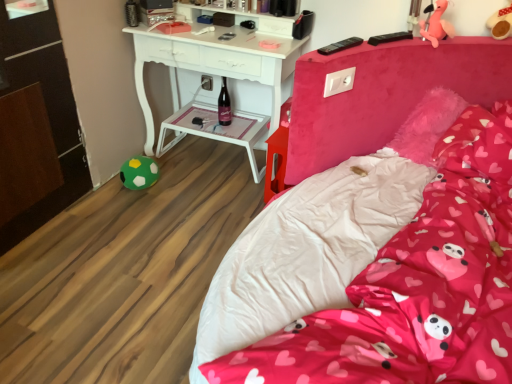
How much space does pink plush toy at upper right, marked as the 3th toy in a bottom-to-top arrangement, occupy vertically?

pink plush toy at upper right, marked as the 3th toy in a bottom-to-top arrangement, is 6.46 inches in height.

I want to click on pink plush toy at upper right, the 3th toy from the left, so click(x=501, y=23).

Where is `pink fabric pillow at center`? pink fabric pillow at center is located at coordinates (479, 143).

Locate an element on the screen. The width and height of the screenshot is (512, 384). pink fabric bed at center is located at coordinates (376, 271).

This screenshot has height=384, width=512. What do you see at coordinates (376, 271) in the screenshot?
I see `pink fabric bed at center` at bounding box center [376, 271].

This screenshot has height=384, width=512. What are the coordinates of `pink plush toy at upper right, the first toy viewed from the front` in the screenshot? It's located at (436, 24).

From the image's perspective, is green felt ball at lower left, the 1th toy when ordered from left to right, over white plastic side table at center?

Incorrect, from the image's perspective, green felt ball at lower left, the 1th toy when ordered from left to right, is lower than white plastic side table at center.

Can you confirm if green felt ball at lower left, acting as the 3th toy starting from the top, is shorter than white plastic side table at center?

Correct, green felt ball at lower left, acting as the 3th toy starting from the top, is not as tall as white plastic side table at center.

Considering the sizes of objects green felt ball at lower left, the 1th toy in the back-to-front sequence, and white plastic side table at center in the image provided, who is thinner, green felt ball at lower left, the 1th toy in the back-to-front sequence, or white plastic side table at center?

green felt ball at lower left, the 1th toy in the back-to-front sequence.

Can white plastic side table at center be found inside green felt ball at lower left, marked as the 3th toy in a right-to-left arrangement?

Actually, white plastic side table at center is outside green felt ball at lower left, marked as the 3th toy in a right-to-left arrangement.

Looking at this image, could you tell me if green felt ball at lower left, the 1th toy in the back-to-front sequence, is facing pink fabric bed at center?

Yes, green felt ball at lower left, the 1th toy in the back-to-front sequence, faces towards pink fabric bed at center.

From a real-world perspective, does green felt ball at lower left, which ranks as the 3th toy in front-to-back order, stand above pink fabric bed at center?

Incorrect, from a real-world perspective, green felt ball at lower left, which ranks as the 3th toy in front-to-back order, is lower than pink fabric bed at center.

Considering their positions, is green felt ball at lower left, acting as the 3th toy starting from the top, located in front of or behind pink fabric bed at center?

In the image, green felt ball at lower left, acting as the 3th toy starting from the top, appears behind pink fabric bed at center.

Which is in front, point (138, 165) or point (264, 260)?

The point (264, 260) is closer.

Between white plastic side table at center and pink fabric pillow at center, which one has larger width?

With larger width is white plastic side table at center.

In the scene shown: Considering the sizes of white plastic side table at center and pink fabric pillow at center in the image, is white plastic side table at center taller or shorter than pink fabric pillow at center?

Considering their sizes, white plastic side table at center has more height than pink fabric pillow at center.

Considering the relative positions of white plastic side table at center and pink fabric pillow at center in the image provided, is white plastic side table at center to the left of pink fabric pillow at center from the viewer's perspective?

Correct, you'll find white plastic side table at center to the left of pink fabric pillow at center.

Is white plastic side table at center aimed at pink fabric pillow at center?

No, white plastic side table at center is not aimed at pink fabric pillow at center.

Between pink fabric bed at center and pink plush toy at upper right, the 3th toy from the left, which one has smaller size?

pink plush toy at upper right, the 3th toy from the left.

From the image's perspective, which object appears higher, pink fabric bed at center or pink plush toy at upper right, the 3th toy from the left?

pink plush toy at upper right, the 3th toy from the left, is shown above in the image.

Does pink fabric bed at center have a greater width compared to pink plush toy at upper right, marked as the 3th toy in a bottom-to-top arrangement?

Indeed, pink fabric bed at center has a greater width compared to pink plush toy at upper right, marked as the 3th toy in a bottom-to-top arrangement.

How many degrees apart are the facing directions of pink fabric bed at center and pink plush toy at upper right, which appears as the 1th toy when viewed from the right?

pink fabric bed at center and pink plush toy at upper right, which appears as the 1th toy when viewed from the right, are facing 23.5 degrees away from each other.

Which point is more distant from viewer, (487, 21) or (340, 329)?

Positioned behind is point (487, 21).

Find the location of `the 2nd toy above the pink fabric bed at center (from a real-world perspective)`. the 2nd toy above the pink fabric bed at center (from a real-world perspective) is located at coordinates (501, 23).

Does pink plush toy at upper right, the 1th toy from the top, have a greater height compared to pink fabric bed at center?

No.

Between pink fabric bed at center and pink fabric pillow at center, which one has larger width?

With larger width is pink fabric bed at center.

Does pink fabric bed at center touch pink fabric pillow at center?

No, pink fabric bed at center is not in contact with pink fabric pillow at center.

Which of these two, pink fabric bed at center or pink fabric pillow at center, stands shorter?

pink fabric pillow at center.

Could you tell me if pink fabric pillow at center is facing pink plush toy at upper right, the third toy from the back?

No.

Between pink fabric pillow at center and pink plush toy at upper right, which is the second toy in top-to-bottom order, which one has larger size?

Bigger between the two is pink fabric pillow at center.

Which of these two, pink fabric pillow at center or pink plush toy at upper right, which is the second toy in left-to-right order, is thinner?

With smaller width is pink plush toy at upper right, which is the second toy in left-to-right order.

From their relative heights in the image, would you say pink fabric pillow at center is taller or shorter than pink plush toy at upper right, the third toy from the back?

Clearly, pink fabric pillow at center is shorter compared to pink plush toy at upper right, the third toy from the back.

Image resolution: width=512 pixels, height=384 pixels. Identify the location of side table above the green felt ball at lower left, which ranks as the 3th toy in front-to-back order (from the image's perspective). (216, 130).

Locate an element on the screen. bed positioned vertically above the green felt ball at lower left, the 1th toy when ordered from left to right (from a real-world perspective) is located at coordinates (376, 271).

Based on the photo, when comparing their distances from pink fabric bed at center, does matte glass bottle at center or white plastic side table at center seem closer?

white plastic side table at center lies closer to pink fabric bed at center than the other object.

Estimate the real-world distances between objects in this image. Which object is closer to pink fabric pillow at center, green felt ball at lower left, the 1th toy in the back-to-front sequence, or pink plush toy at upper right, which appears as the second toy when viewed from the front?

pink plush toy at upper right, which appears as the second toy when viewed from the front, is positioned closer to the anchor pink fabric pillow at center.

Estimate the real-world distances between objects in this image. Which object is closer to pink plush toy at upper right, marked as the 3th toy in a bottom-to-top arrangement, matte glass bottle at center or white plastic side table at center?

matte glass bottle at center.

Looking at the image, which one is located closer to pink plush toy at upper right, marked as the 3th toy in a bottom-to-top arrangement, green felt ball at lower left, acting as the 3th toy starting from the top, or pink plush toy at upper right, arranged as the second toy when viewed from the right?

Based on the image, pink plush toy at upper right, arranged as the second toy when viewed from the right, appears to be nearer to pink plush toy at upper right, marked as the 3th toy in a bottom-to-top arrangement.

When comparing their distances from pink fabric pillow at center, does green felt ball at lower left, the 1th toy when ordered from bottom to top, or pink fabric bed at center seem further?

green felt ball at lower left, the 1th toy when ordered from bottom to top.

From the image, which object appears to be farther from matte glass bottle at center, white plastic side table at center or pink fabric pillow at center?

pink fabric pillow at center is further to matte glass bottle at center.

Looking at the image, which one is located further to white plastic side table at center, matte glass bottle at center or pink plush toy at upper right, the 3th toy from the left?

Based on the image, pink plush toy at upper right, the 3th toy from the left, appears to be further to white plastic side table at center.

Based on the photo, based on their spatial positions, is white plastic side table at center or pink fabric bed at center further from pink plush toy at upper right, which is the second toy in left-to-right order?

white plastic side table at center is further to pink plush toy at upper right, which is the second toy in left-to-right order.

Where is `side table situated between green felt ball at lower left, the 1th toy in the back-to-front sequence, and pink plush toy at upper right, arranged as the second toy when viewed from the right, from left to right`? This screenshot has width=512, height=384. side table situated between green felt ball at lower left, the 1th toy in the back-to-front sequence, and pink plush toy at upper right, arranged as the second toy when viewed from the right, from left to right is located at coordinates [216, 130].

Find the location of a particular element. Image resolution: width=512 pixels, height=384 pixels. toy between matte glass bottle at center and pink fabric pillow at center from left to right is located at coordinates (436, 24).

At what (x,y) coordinates should I click in order to perform the action: click on side table situated between green felt ball at lower left, which ranks as the 3th toy in front-to-back order, and pink plush toy at upper right, which appears as the 1th toy when viewed from the right, from left to right. Please return your answer as a coordinate pair (x, y). The image size is (512, 384). Looking at the image, I should click on (216, 130).

In order to click on bottle situated between green felt ball at lower left, which ranks as the 3th toy in front-to-back order, and pink plush toy at upper right, which is the second toy in left-to-right order, from left to right in this screenshot , I will do `click(224, 105)`.